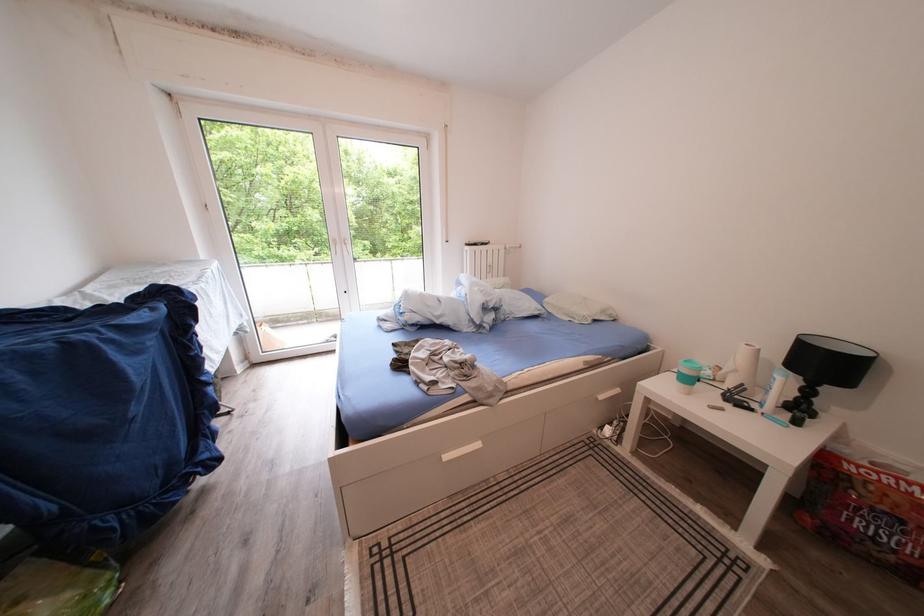
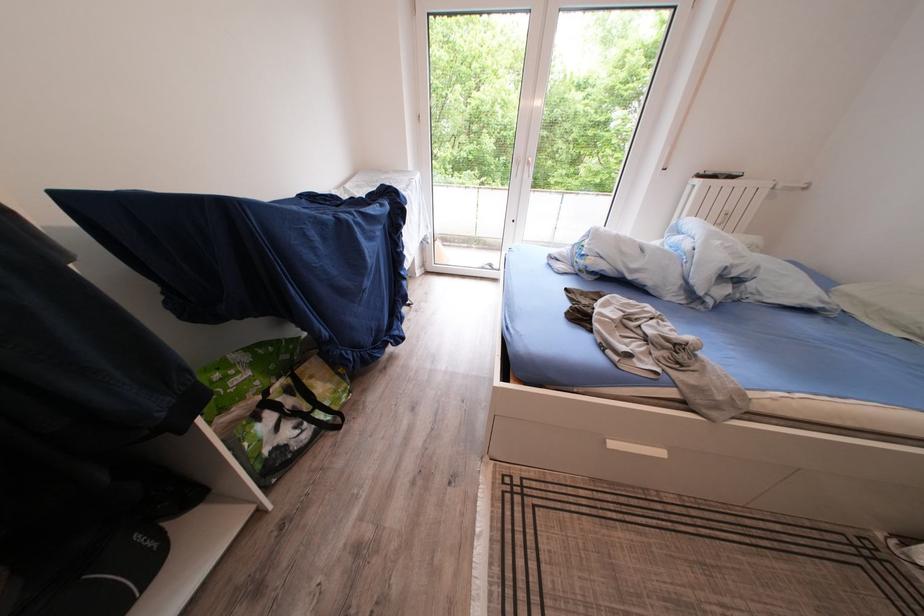
The point at (497, 267) is marked in the first image. Where is the corresponding point in the second image?

(737, 213)